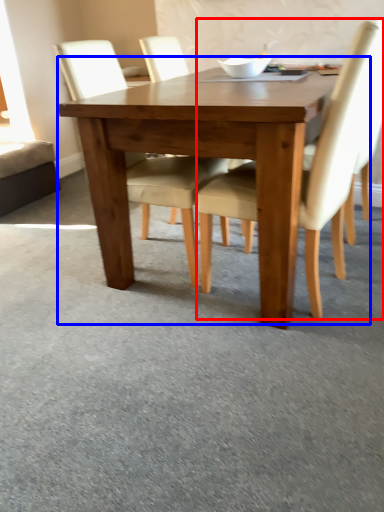
Question: Which object appears farthest to the camera in this image, chair (highlighted by a red box) or kitchen & dining room table (highlighted by a blue box)?

Choices:
 (A) chair
 (B) kitchen & dining room table

Answer: (B)